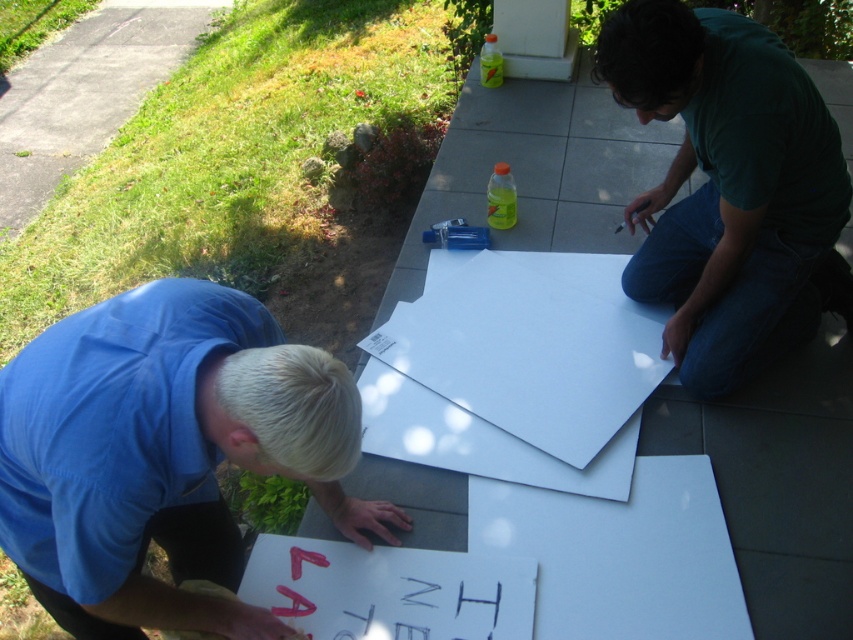
You are a delivery person who needs to place a small box on the ground between the white paper at lower left and the white matte paper at center. Since the box is 10 cm tall, will it fit vertically between them without overlapping?

The white paper at lower left is taller than the white matte paper at center. Since the box is only 10 cm tall, it should fit vertically between them as long as there is enough horizontal space. However, the exact vertical clearance depends on the height difference between the two papers, which isn

You are a photographer wanting to capture both the white paper at lower left and the white matte paper at center in a single shot. Based on their positions, which paper should you position closer to the camera to ensure both are fully visible in the frame?

Since the white paper at lower left is to the left of white matte paper at center, positioning the white paper at lower left closer to the camera would allow both papers to be fully visible in the frame.